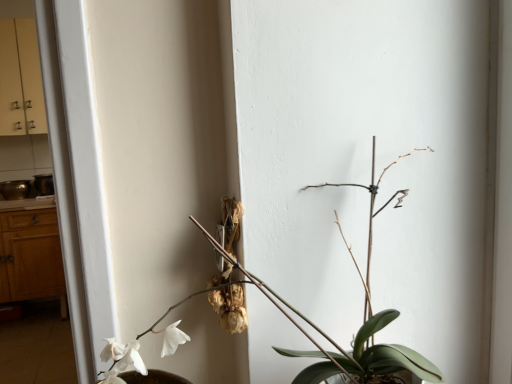
Question: From the image's perspective, relative to green matte plant at center, is wooden counter top at left above or below?

Choices:
 (A) above
 (B) below

Answer: (A)

Question: From a real-world perspective, is wooden counter top at left physically located above or below green matte plant at center?

Choices:
 (A) below
 (B) above

Answer: (A)

Question: Which of these objects is positioned farthest from the green matte plant at center?

Choices:
 (A) wooden dresser at left
 (B) wooden counter top at left

Answer: (B)

Question: Which object is the closest to the green matte plant at center?

Choices:
 (A) wooden dresser at left
 (B) wooden counter top at left

Answer: (A)